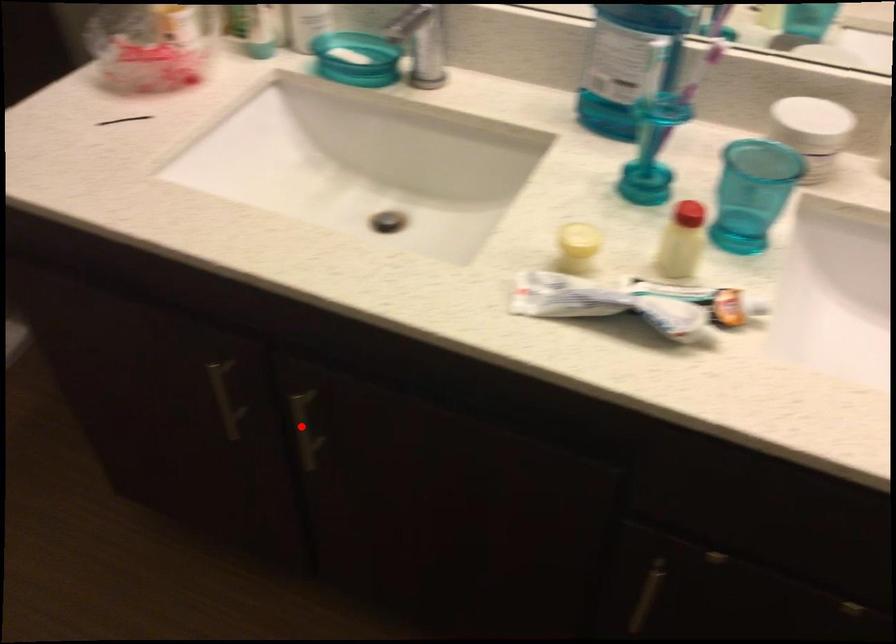
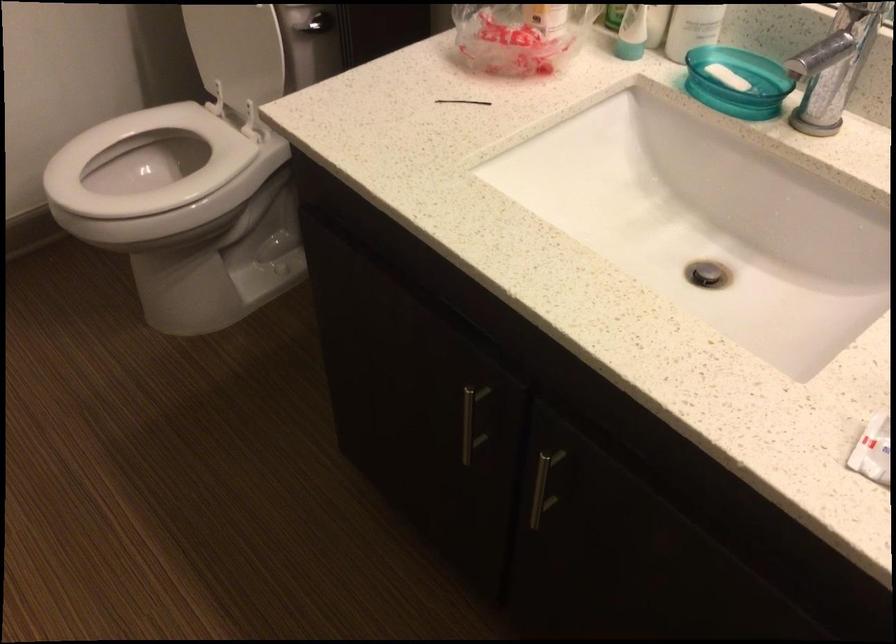
Where in the second image is the point corresponding to the highlighted location from the first image?

(543, 486)